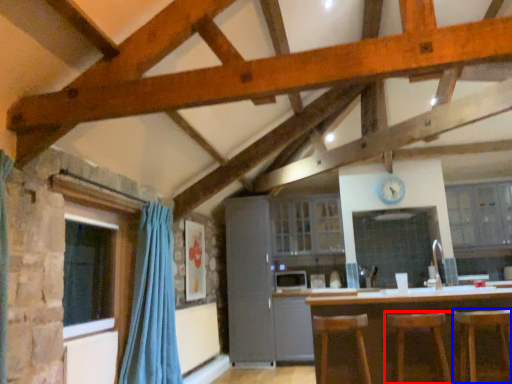
Question: Which object appears farthest to the camera in this image, bar stool (highlighted by a red box) or bar stool (highlighted by a blue box)?

Choices:
 (A) bar stool
 (B) bar stool

Answer: (A)